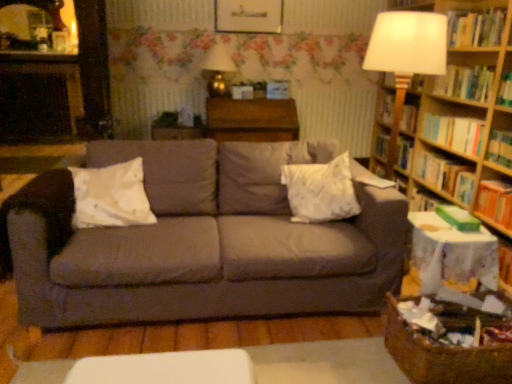
Question: Should I look upward or downward to see orange hardcover book at right, marked as the 1th book in a bottom-to-top arrangement?

Choices:
 (A) down
 (B) up

Answer: (A)

Question: Is orange hardcover book at right, marked as the sixth book in a top-to-bottom arrangement, closer to the viewer compared to green matte paperback book at right?

Choices:
 (A) yes
 (B) no

Answer: (B)

Question: Is orange hardcover book at right, marked as the sixth book in a top-to-bottom arrangement, wider than green matte paperback book at right?

Choices:
 (A) yes
 (B) no

Answer: (B)

Question: From the image's perspective, is orange hardcover book at right, marked as the 1th book in a bottom-to-top arrangement, on top of green matte paperback book at right?

Choices:
 (A) no
 (B) yes

Answer: (B)

Question: Can you confirm if orange hardcover book at right, marked as the 1th book in a bottom-to-top arrangement, is positioned to the left of green matte paperback book at right?

Choices:
 (A) yes
 (B) no

Answer: (B)

Question: From the image's perspective, is orange hardcover book at right, marked as the 1th book in a bottom-to-top arrangement, below green matte paperback book at right?

Choices:
 (A) no
 (B) yes

Answer: (A)

Question: From a real-world perspective, is orange hardcover book at right, marked as the 1th book in a bottom-to-top arrangement, physically below green matte paperback book at right?

Choices:
 (A) yes
 (B) no

Answer: (A)

Question: Considering the relative sizes of hardcover book at right, the fifth book viewed from the top, and wooden table at center in the image provided, is hardcover book at right, the fifth book viewed from the top, shorter than wooden table at center?

Choices:
 (A) no
 (B) yes

Answer: (B)

Question: Could wooden table at center be considered to be inside hardcover book at right, the 2th book positioned from the bottom?

Choices:
 (A) no
 (B) yes

Answer: (A)

Question: From the image's perspective, is hardcover book at right, the fifth book viewed from the top, below wooden table at center?

Choices:
 (A) no
 (B) yes

Answer: (B)

Question: Can you confirm if hardcover book at right, the fifth book viewed from the top, is bigger than wooden table at center?

Choices:
 (A) no
 (B) yes

Answer: (A)

Question: Could you tell me if hardcover book at right, the fifth book viewed from the top, is facing wooden table at center?

Choices:
 (A) no
 (B) yes

Answer: (B)

Question: Can you confirm if hardcover book at right, the fifth book viewed from the top, is thinner than wooden table at center?

Choices:
 (A) yes
 (B) no

Answer: (A)

Question: Does gray fabric couch at center have a greater width compared to white fabric pillow at center, the first pillow in the right-to-left sequence?

Choices:
 (A) no
 (B) yes

Answer: (B)